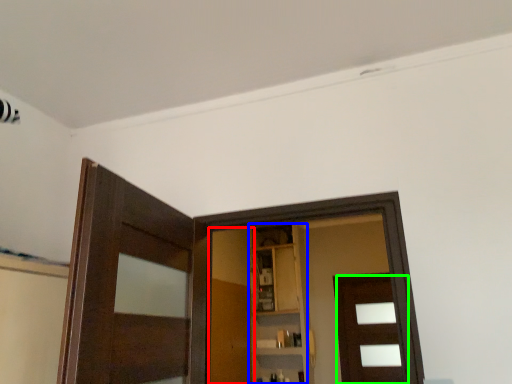
Question: Estimate the real-world distances between objects in this image. Which object is farther from barn door (highlighted by a red box), cabinetry (highlighted by a blue box) or door (highlighted by a green box)?

Choices:
 (A) cabinetry
 (B) door

Answer: (B)